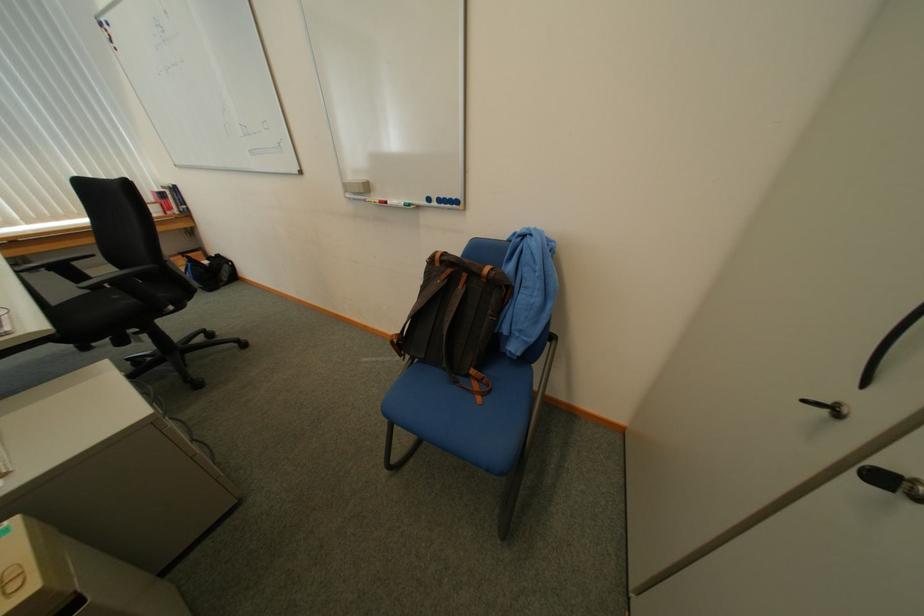
At what (x,y) coordinates should I click in order to perform the action: click on cabinet handle. Please return your answer as a coordinate pair (x, y). The image size is (924, 616). Looking at the image, I should click on (x=828, y=408).